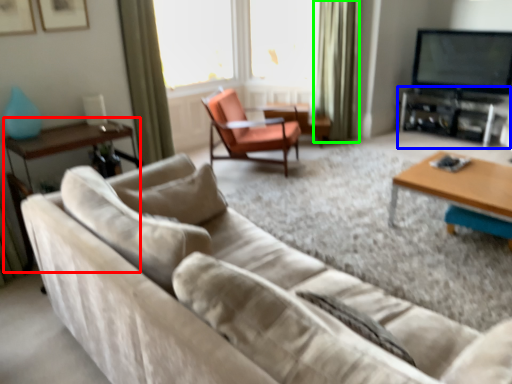
Question: Estimate the real-world distances between objects in this image. Which object is farther from side table (highlighted by a red box), entertainment center (highlighted by a blue box) or curtain (highlighted by a green box)?

Choices:
 (A) entertainment center
 (B) curtain

Answer: (A)